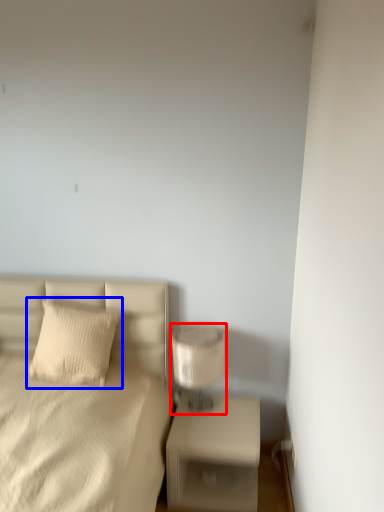
Question: Which object appears closest to the camera in this image, table lamp (highlighted by a red box) or pillow (highlighted by a blue box)?

Choices:
 (A) table lamp
 (B) pillow

Answer: (A)